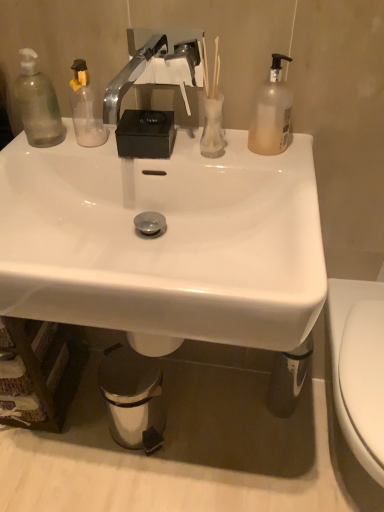
You are a GUI agent. You are given a task and a screenshot of the screen. Output one action in this format:
    pyautogui.click(x=<x>, y=<y>)
    Task: Click on the white glossy toilet at right
    The height and width of the screenshot is (512, 384).
    Given the screenshot: What is the action you would take?
    pyautogui.click(x=358, y=386)

Describe the element at coordinates (156, 66) in the screenshot. I see `chrome metallic faucet at upper center` at that location.

I want to click on shiny metallic trash can at lower center, so click(x=133, y=398).

The width and height of the screenshot is (384, 512). I want to click on white glossy toilet at right, so click(x=358, y=386).

Between white glossy toilet at right and transparent plastic bottle at left, positioned as the 2th bottle in right-to-left order, which one has smaller size?

Smaller between the two is transparent plastic bottle at left, positioned as the 2th bottle in right-to-left order.

Is white glossy toilet at right oriented towards transparent plastic bottle at left, positioned as the 2th bottle in right-to-left order?

No, white glossy toilet at right does not turn towards transparent plastic bottle at left, positioned as the 2th bottle in right-to-left order.

How different are the orientations of translucent plastic bottle at upper right, placed as the first bottle when sorted from right to left, and white glossy toilet at right in degrees?

0.293 degrees separate the facing orientations of translucent plastic bottle at upper right, placed as the first bottle when sorted from right to left, and white glossy toilet at right.

Which of these two, translucent plastic bottle at upper right, placed as the 2th bottle when sorted from left to right, or white glossy toilet at right, stands shorter?

With less height is translucent plastic bottle at upper right, placed as the 2th bottle when sorted from left to right.

Considering the relative sizes of translucent plastic bottle at upper right, placed as the first bottle when sorted from right to left, and white glossy toilet at right in the image provided, is translucent plastic bottle at upper right, placed as the first bottle when sorted from right to left, thinner than white glossy toilet at right?

Yes, translucent plastic bottle at upper right, placed as the first bottle when sorted from right to left, is thinner than white glossy toilet at right.

Locate an element on the screen. The height and width of the screenshot is (512, 384). toilet on the right of translucent plastic bottle at upper right, placed as the 2th bottle when sorted from left to right is located at coordinates (358, 386).

Locate an element on the screen. trash bin/can below the translucent plastic bottle at upper right, placed as the first bottle when sorted from right to left (from the image's perspective) is located at coordinates (133, 398).

Are shiny metallic trash can at lower center and translucent plastic bottle at upper right, placed as the 2th bottle when sorted from left to right, making contact?

No, shiny metallic trash can at lower center is not touching translucent plastic bottle at upper right, placed as the 2th bottle when sorted from left to right.

Is point (133, 365) positioned behind point (292, 102)?

Yes, point (133, 365) is farther from viewer.

From the image's perspective, is shiny metallic trash can at lower center below translucent plastic bottle at upper right, placed as the first bottle when sorted from right to left?

Yes.

In the scene shown: What's the angular difference between transparent plastic bottle at left, positioned as the 2th bottle in right-to-left order, and shiny metallic trash can at lower center's facing directions?

The facing directions of transparent plastic bottle at left, positioned as the 2th bottle in right-to-left order, and shiny metallic trash can at lower center are 13.1 degrees apart.

Does transparent plastic bottle at left, positioned as the 2th bottle in right-to-left order, have a lesser height compared to shiny metallic trash can at lower center?

Yes.

Which point is more forward, (37, 141) or (161, 398)?

The point (37, 141) is closer.

From the image's perspective, is transparent plastic bottle at left, which is the first bottle from left to right, above shiny metallic trash can at lower center?

Yes, from the image's perspective, transparent plastic bottle at left, which is the first bottle from left to right, is on top of shiny metallic trash can at lower center.

From the image's perspective, which one is positioned higher, transparent glass vase at upper center or shiny metallic trash can at lower center?

transparent glass vase at upper center is shown above in the image.

Is there a large distance between transparent glass vase at upper center and shiny metallic trash can at lower center?

No, there isn't a large distance between transparent glass vase at upper center and shiny metallic trash can at lower center.

In the scene shown: Could shiny metallic trash can at lower center be considered to be inside transparent glass vase at upper center?

Definitely not — shiny metallic trash can at lower center is not inside transparent glass vase at upper center.

From a real-world perspective, which object rests below the other?

In real-world perspective, shiny metallic trash can at lower center is lower.

Can you confirm if transparent plastic bottle at left, which is the first bottle from left to right, is thinner than chrome metallic faucet at upper center?

Yes, transparent plastic bottle at left, which is the first bottle from left to right, is thinner than chrome metallic faucet at upper center.

In terms of height, does transparent plastic bottle at left, positioned as the 2th bottle in right-to-left order, look taller or shorter compared to chrome metallic faucet at upper center?

Considering their sizes, transparent plastic bottle at left, positioned as the 2th bottle in right-to-left order, has more height than chrome metallic faucet at upper center.

Is chrome metallic faucet at upper center surrounded by transparent plastic bottle at left, positioned as the 2th bottle in right-to-left order?

No, chrome metallic faucet at upper center is not a part of transparent plastic bottle at left, positioned as the 2th bottle in right-to-left order.

Is transparent plastic bottle at left, positioned as the 2th bottle in right-to-left order, oriented away from chrome metallic faucet at upper center?

No, transparent plastic bottle at left, positioned as the 2th bottle in right-to-left order, is not facing the opposite direction of chrome metallic faucet at upper center.

In terms of width, does translucent plastic bottle at upper right, placed as the 2th bottle when sorted from left to right, look wider or thinner when compared to shiny metallic trash can at lower center?

Considering their sizes, translucent plastic bottle at upper right, placed as the 2th bottle when sorted from left to right, looks slimmer than shiny metallic trash can at lower center.

From a real-world perspective, which object rests below the other?

shiny metallic trash can at lower center, from a real-world perspective.

From their relative heights in the image, would you say translucent plastic bottle at upper right, placed as the first bottle when sorted from right to left, is taller or shorter than shiny metallic trash can at lower center?

translucent plastic bottle at upper right, placed as the first bottle when sorted from right to left, is shorter than shiny metallic trash can at lower center.

Which is in front, point (265, 148) or point (132, 351)?

Point (265, 148)

The height and width of the screenshot is (512, 384). In order to click on toilet directly beneath the transparent plastic bottle at left, positioned as the 2th bottle in right-to-left order (from a real-world perspective) in this screenshot , I will do `click(358, 386)`.

Identify the location of toilet located below the translucent plastic bottle at upper right, placed as the first bottle when sorted from right to left (from the image's perspective). The height and width of the screenshot is (512, 384). coord(358,386).

Looking at the image, which one is located further to transparent glass vase at upper center, white glossy sink at center or transparent plastic bottle at left, positioned as the 2th bottle in right-to-left order?

transparent plastic bottle at left, positioned as the 2th bottle in right-to-left order, is further to transparent glass vase at upper center.

Looking at the image, which one is located closer to transparent glass vase at upper center, shiny metallic trash can at lower center or white glossy toilet at right?

The object closer to transparent glass vase at upper center is white glossy toilet at right.

From the picture: Looking at the image, which one is located further to white glossy toilet at right, translucent plastic bottle at upper right, placed as the first bottle when sorted from right to left, or transparent plastic bottle at left, which is the first bottle from left to right?

transparent plastic bottle at left, which is the first bottle from left to right.

When comparing their distances from shiny metallic trash can at lower center, does white glossy sink at center or translucent plastic bottle at upper right, placed as the 2th bottle when sorted from left to right, seem further?

Among the two, translucent plastic bottle at upper right, placed as the 2th bottle when sorted from left to right, is located further to shiny metallic trash can at lower center.

Considering their positions, is chrome metallic faucet at upper center positioned further to translucent plastic bottle at upper right, placed as the 2th bottle when sorted from left to right, than transparent glass vase at upper center?

The object further to translucent plastic bottle at upper right, placed as the 2th bottle when sorted from left to right, is chrome metallic faucet at upper center.

From the image, which object appears to be nearer to transparent glass vase at upper center, white glossy sink at center or translucent plastic bottle at upper right, placed as the 2th bottle when sorted from left to right?

Among the two, translucent plastic bottle at upper right, placed as the 2th bottle when sorted from left to right, is located nearer to transparent glass vase at upper center.

Which object lies further to the anchor point transparent plastic bottle at left, which is the first bottle from left to right, translucent plastic bottle at upper right, placed as the first bottle when sorted from right to left, or white glossy sink at center?

translucent plastic bottle at upper right, placed as the first bottle when sorted from right to left, lies further to transparent plastic bottle at left, which is the first bottle from left to right, than the other object.

Estimate the real-world distances between objects in this image. Which object is closer to shiny metallic trash can at lower center, white glossy sink at center or chrome metallic faucet at upper center?

white glossy sink at center.

I want to click on toilet between transparent plastic bottle at left, positioned as the 2th bottle in right-to-left order, and shiny metallic trash can at lower center, in the vertical direction, so click(358, 386).

The image size is (384, 512). What are the coordinates of `faucet between transparent plastic bottle at left, which is the first bottle from left to right, and translucent plastic bottle at upper right, placed as the first bottle when sorted from right to left, from left to right` in the screenshot? It's located at (156, 66).

Where is `sink between transparent glass vase at upper center and white glossy toilet at right from top to bottom`? sink between transparent glass vase at upper center and white glossy toilet at right from top to bottom is located at coordinates (164, 242).

Where is `sink between chrome metallic faucet at upper center and white glossy toilet at right from top to bottom`? sink between chrome metallic faucet at upper center and white glossy toilet at right from top to bottom is located at coordinates (164, 242).